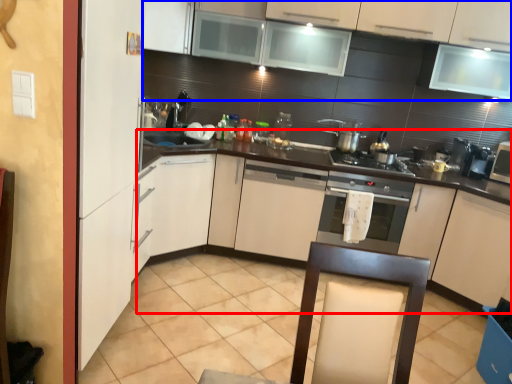
Question: Which point is further to the camera, counter (highlighted by a red box) or cabinetry (highlighted by a blue box)?

Choices:
 (A) counter
 (B) cabinetry

Answer: (A)